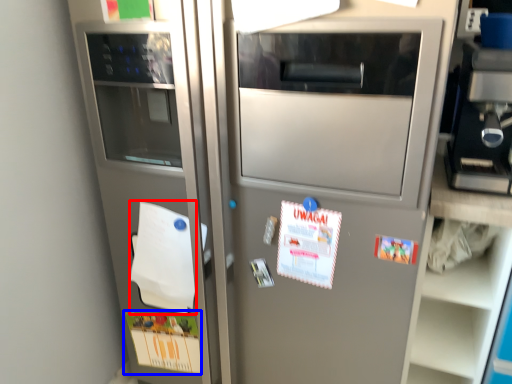
Question: Which object is closer to the camera taking this photo, notepad (highlighted by a red box) or postcard (highlighted by a blue box)?

Choices:
 (A) notepad
 (B) postcard

Answer: (A)